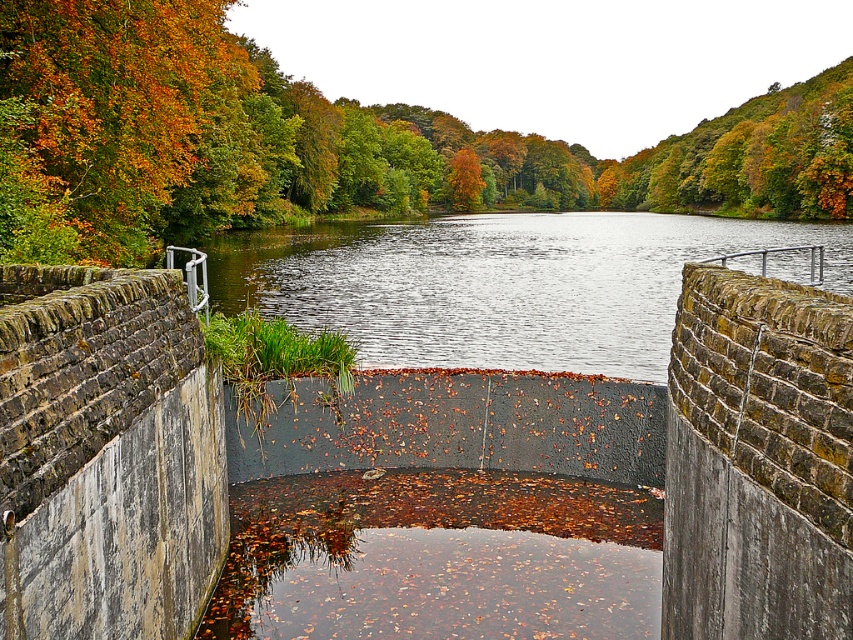
Question: Among these objects, which one is farthest from the camera?

Choices:
 (A) smooth concrete river at center
 (B) autumn leaves at upper left

Answer: (B)

Question: Considering the real-world distances, which object is farthest from the smooth concrete river at center?

Choices:
 (A) autumn leaves at upper center
 (B) autumn leaves at upper left

Answer: (A)

Question: Is the position of autumn leaves at upper center more distant than that of smooth concrete river at center?

Choices:
 (A) yes
 (B) no

Answer: (A)

Question: Does autumn leaves at upper center come in front of smooth concrete river at center?

Choices:
 (A) yes
 (B) no

Answer: (B)

Question: Based on their relative distances, which object is nearer to the autumn leaves at upper left?

Choices:
 (A) smooth concrete river at center
 (B) autumn leaves at upper center

Answer: (A)

Question: Is smooth concrete river at center to the left of autumn leaves at upper left from the viewer's perspective?

Choices:
 (A) no
 (B) yes

Answer: (A)